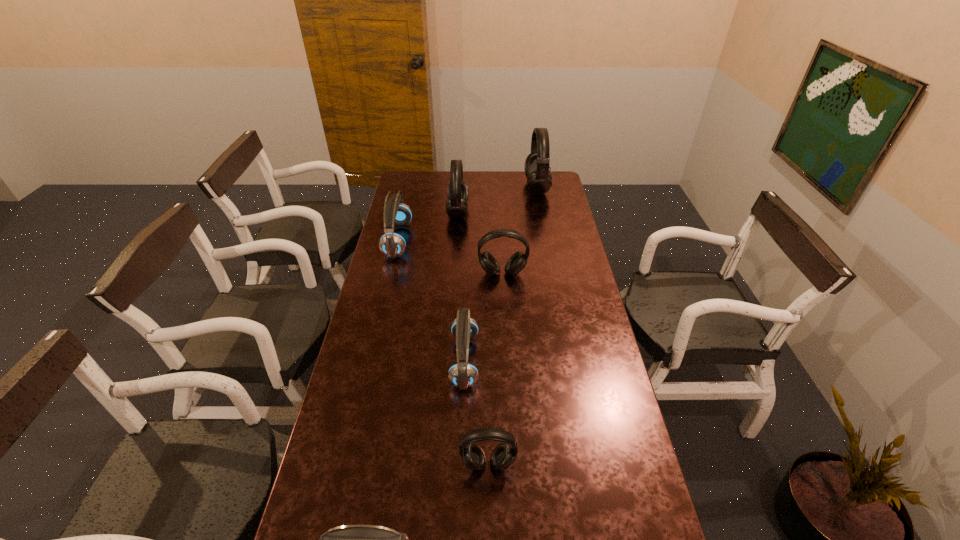
I want to click on the tallest headset, so tap(539, 179).

The width and height of the screenshot is (960, 540). In order to click on the tallest object in this screenshot , I will do `click(539, 179)`.

Image resolution: width=960 pixels, height=540 pixels. I want to click on the second tallest headset, so click(x=457, y=193).

The width and height of the screenshot is (960, 540). I want to click on the sixth shortest object, so click(457, 193).

Where is `the biggest blue headset`? the biggest blue headset is located at coordinates (392, 244).

I want to click on the second nearest gray headset, so click(x=516, y=263).

This screenshot has height=540, width=960. I want to click on the second smallest gray headset, so click(516, 263).

Where is `the second smallest blue headset`? the second smallest blue headset is located at coordinates (462, 374).

Where is `the rightmost blue headset`? The width and height of the screenshot is (960, 540). the rightmost blue headset is located at coordinates (462, 374).

Find the location of a particular element. the nearest gray headset is located at coordinates (503, 456).